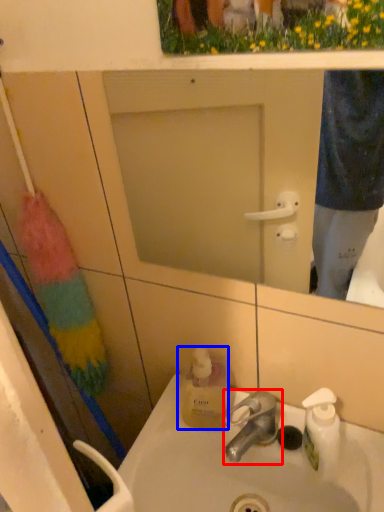
Question: Which point is further to the camera, tap (highlighted by a red box) or bottle (highlighted by a blue box)?

Choices:
 (A) tap
 (B) bottle

Answer: (B)